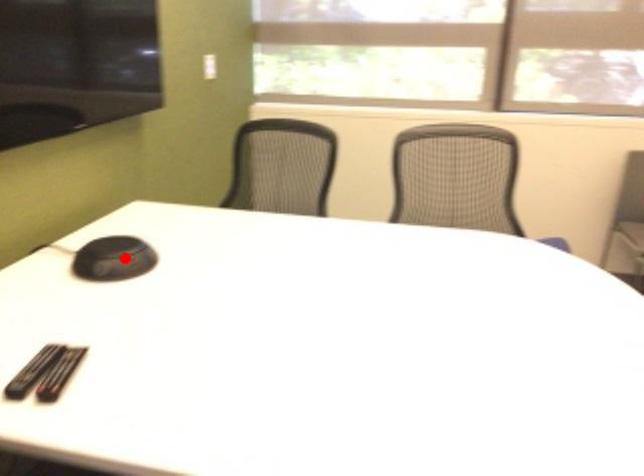
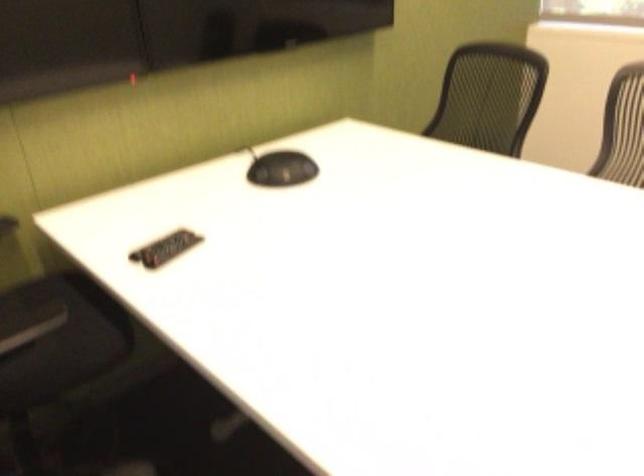
Question: A red point is marked in image1. In image2, is the corresponding 3D point closer to the camera or farther? Reply with the corresponding letter.

Choices:
 (A) The corresponding 3D point is closer.
 (B) The corresponding 3D point is farther.

Answer: (B)